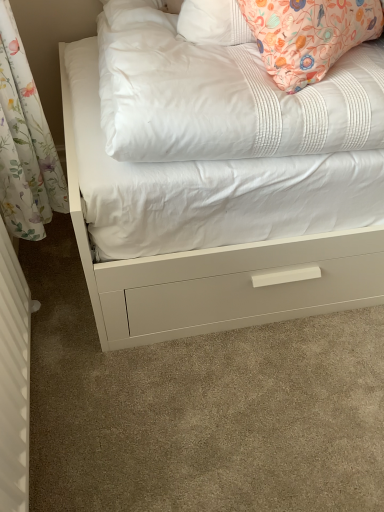
Question: Considering the positions of point (352, 83) and point (18, 281), is point (352, 83) closer or farther from the camera than point (18, 281)?

Choices:
 (A) farther
 (B) closer

Answer: (B)

Question: Based on their positions, is white quilted mattress at upper center located to the left or right of white textured radiator at left?

Choices:
 (A) left
 (B) right

Answer: (B)

Question: Considering the positions of white quilted mattress at upper center and white textured radiator at left in the image, is white quilted mattress at upper center bigger or smaller than white textured radiator at left?

Choices:
 (A) big
 (B) small

Answer: (A)

Question: Is white textured radiator at left wider or thinner than white quilted mattress at upper center?

Choices:
 (A) wide
 (B) thin

Answer: (B)

Question: In terms of height, does white textured radiator at left look taller or shorter compared to white quilted mattress at upper center?

Choices:
 (A) tall
 (B) short

Answer: (A)

Question: In the image, is white textured radiator at left positioned in front of or behind white quilted mattress at upper center?

Choices:
 (A) behind
 (B) front

Answer: (B)

Question: Is white textured radiator at left inside or outside of white quilted mattress at upper center?

Choices:
 (A) outside
 (B) inside

Answer: (A)